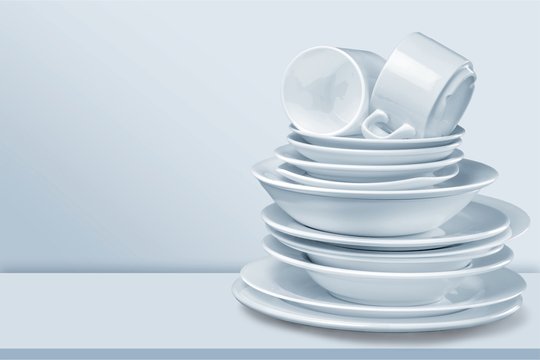
Locate an element on the screen. bowls is located at coordinates (421, 278), (451, 257), (458, 253), (426, 204).